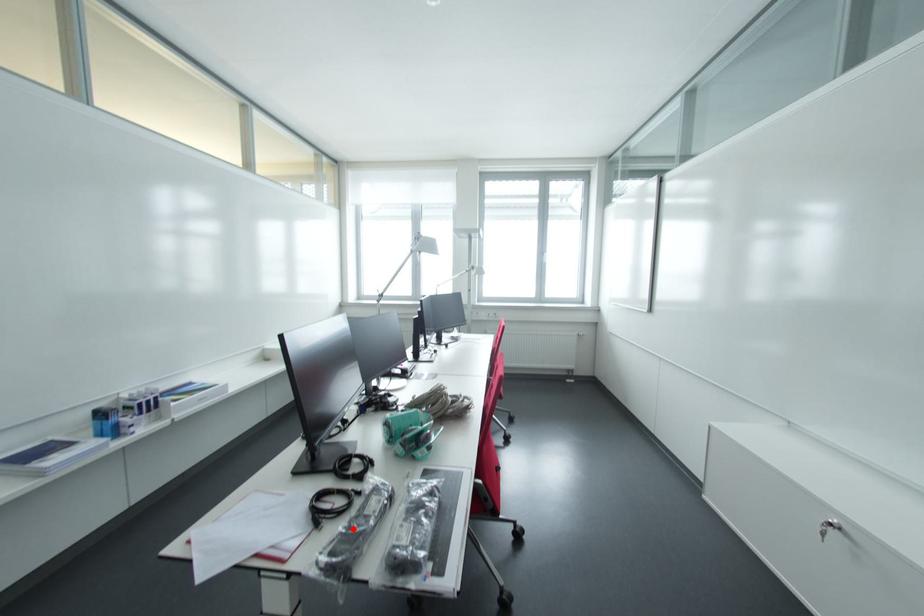
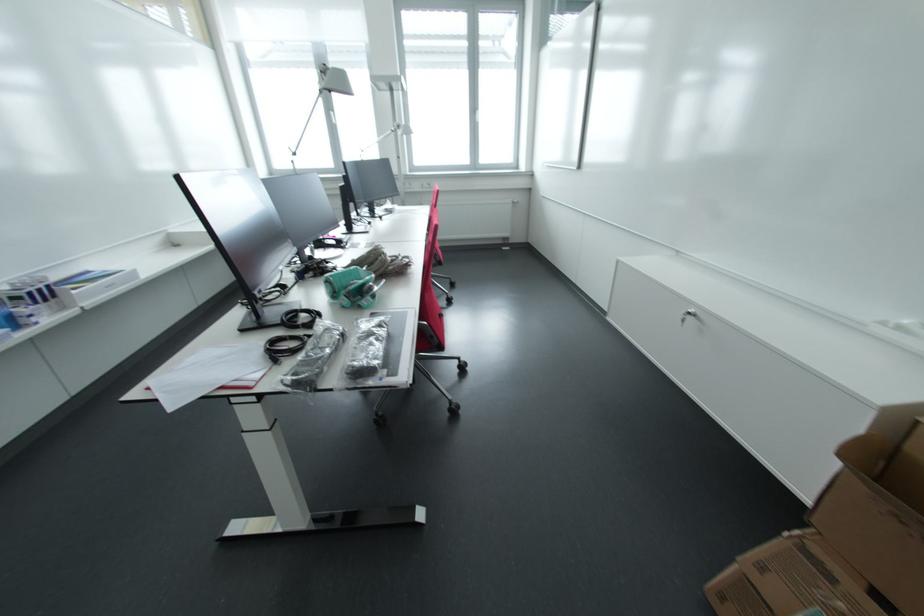
The point at the highlighted location is marked in the first image. Where is the corresponding point in the second image?

(310, 358)